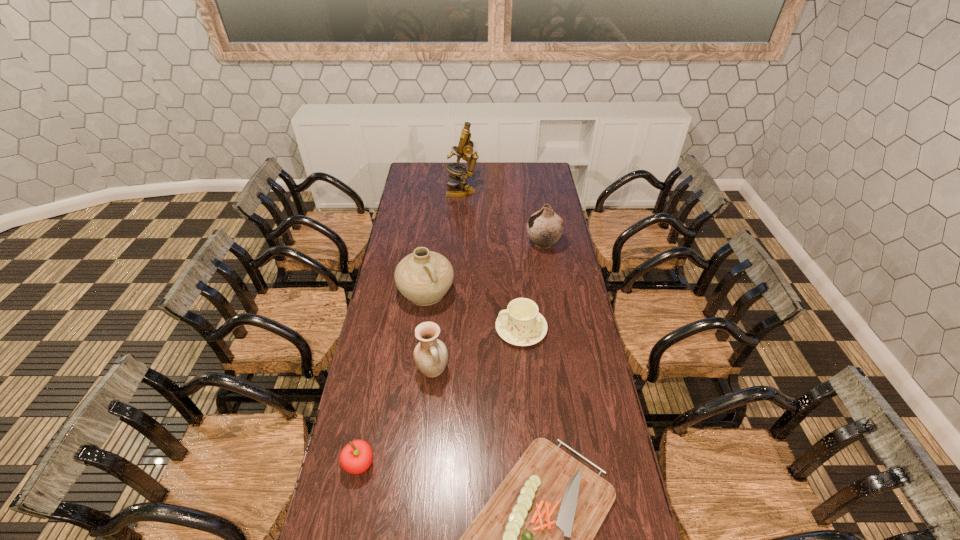
Image resolution: width=960 pixels, height=540 pixels. I want to click on object that is the sixth closest to the chinaware, so click(x=465, y=147).

Image resolution: width=960 pixels, height=540 pixels. I want to click on object that ranks as the sixth closest to the second farthest pottery, so click(465, 147).

You are a GUI agent. You are given a task and a screenshot of the screen. Output one action in this format:
    pyautogui.click(x=<x>, y=<y>)
    Task: Click on the pottery that is the third closest to the chinaware
    The image size is (960, 540).
    Given the screenshot: What is the action you would take?
    pyautogui.click(x=544, y=227)

Point out which pottery is positioned as the second nearest to the chinaware. Please provide its 2D coordinates. Your answer should be formatted as a tuple, i.e. [(x, y)], where the tuple contains the x and y coordinates of a point satisfying the conditions above.

[(430, 355)]

You are a GUI agent. You are given a task and a screenshot of the screen. Output one action in this format:
    pyautogui.click(x=<x>, y=<y>)
    Task: Click on the free space that satisfies the following two spatial constraints: 1. on the handle side of the chinaware; 2. on the front side of the fifth farthest object
    This screenshot has width=960, height=540.
    Given the screenshot: What is the action you would take?
    pyautogui.click(x=525, y=370)

This screenshot has width=960, height=540. Identify the location of vacant space that satisfies the following two spatial constraints: 1. from the spout of the rightmost pottery; 2. on the front side of the nearest pottery. (564, 370).